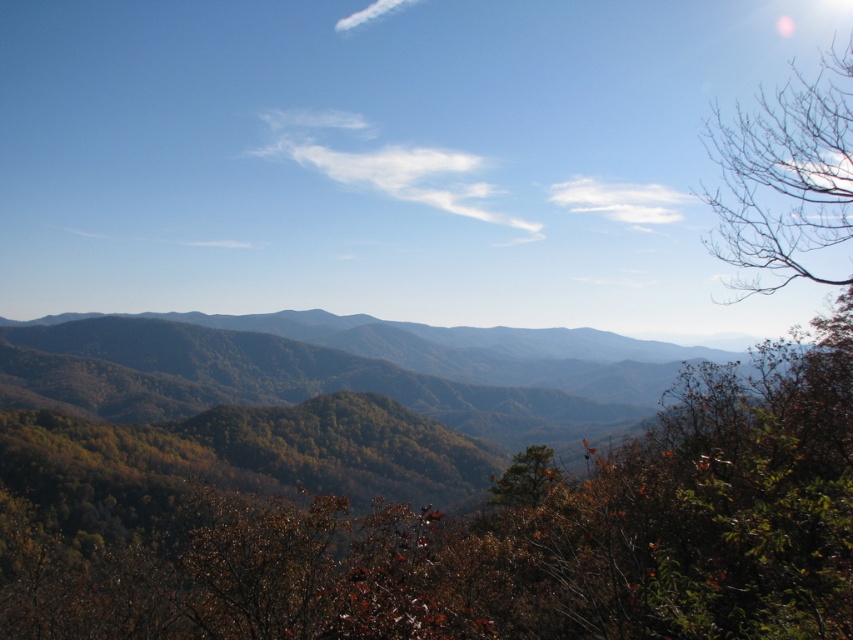
Based on the photo, can you confirm if bare branches at upper right is positioned above green matte tree at center?

Indeed, bare branches at upper right is positioned over green matte tree at center.

Does bare branches at upper right appear under green matte tree at center?

Incorrect, bare branches at upper right is not positioned below green matte tree at center.

Who is more forward, [772,209] or [543,480]?

Point [772,209] is in front.

Identify the location of bare branches at upper right. (784, 177).

Does green leafy tree at center appear on the right side of green matte tree at center?

In fact, green leafy tree at center is to the left of green matte tree at center.

Is point (0, 576) behind point (541, 461)?

No.

Locate an element on the screen. This screenshot has height=640, width=853. green leafy tree at center is located at coordinates (491, 536).

Does green leafy tree at center have a larger size compared to bare branches at upper right?

No.

Does point (786, 452) come in front of point (770, 141)?

Yes, it is in front of point (770, 141).

What are the coordinates of `green leafy tree at center` in the screenshot? It's located at (491, 536).